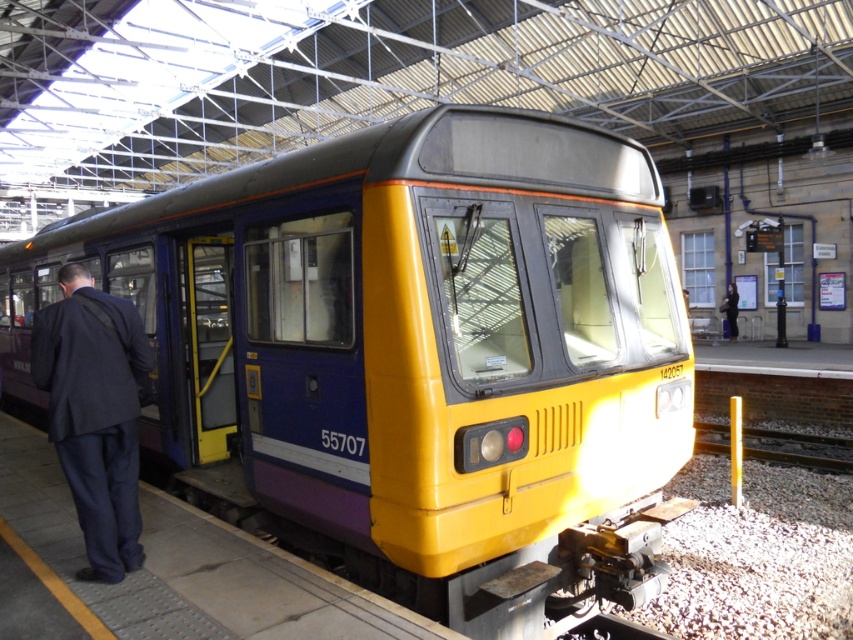
You are standing at the station platform and want to take a photo of the yellow matte train at center. The camera you have can focus on objects up to 5 meters away. Will the train be in focus?

The yellow matte train at center is 5.41 meters from camera, which is beyond the camera focus range of 5 meters. The train will not be in focus.

You are a passenger holding a 1.2 meter wide luggage cart. You need to move from the dark blue suit at left to the metallic gray train track at right. Is there enough space for your cart to pass through the area between them?

The distance between the dark blue suit at left and the metallic gray train track at right is 9.10 meters. Since the luggage cart is 1.2 meters wide, there is sufficient space for it to pass through the area between them.

You are a maintenance worker checking the width of the yellow matte train at center and the metallic gray train track at right. Which object has a greater width?

The metallic gray train track at right is wider than the yellow matte train at center.